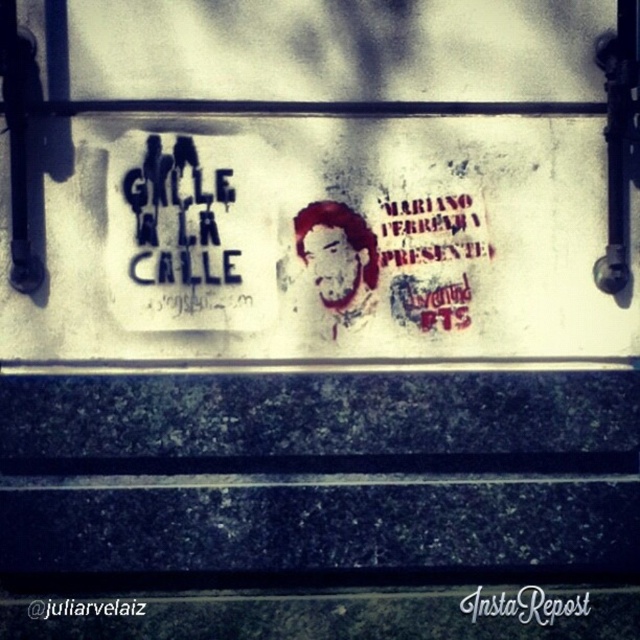
Question: Does blood-stained portrait at center have a lesser width compared to white paper instarepost at center?

Choices:
 (A) no
 (B) yes

Answer: (B)

Question: Is blood-stained portrait at center to the right of white paper instarepost at center from the viewer's perspective?

Choices:
 (A) yes
 (B) no

Answer: (B)

Question: In this image, where is blood-stained portrait at center located relative to white paper instarepost at center?

Choices:
 (A) right
 (B) left

Answer: (B)

Question: Which point is farther to the camera?

Choices:
 (A) white paper instarepost at center
 (B) blood-stained portrait at center

Answer: (B)

Question: Which point is farther to the camera?

Choices:
 (A) white paper instarepost at center
 (B) blood-stained portrait at center

Answer: (B)